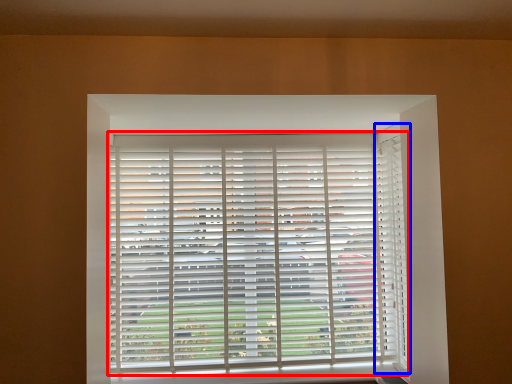
Question: Which of the following is the closest to the observer, window blind (highlighted by a red box) or curtain (highlighted by a blue box)?

Choices:
 (A) window blind
 (B) curtain

Answer: (B)